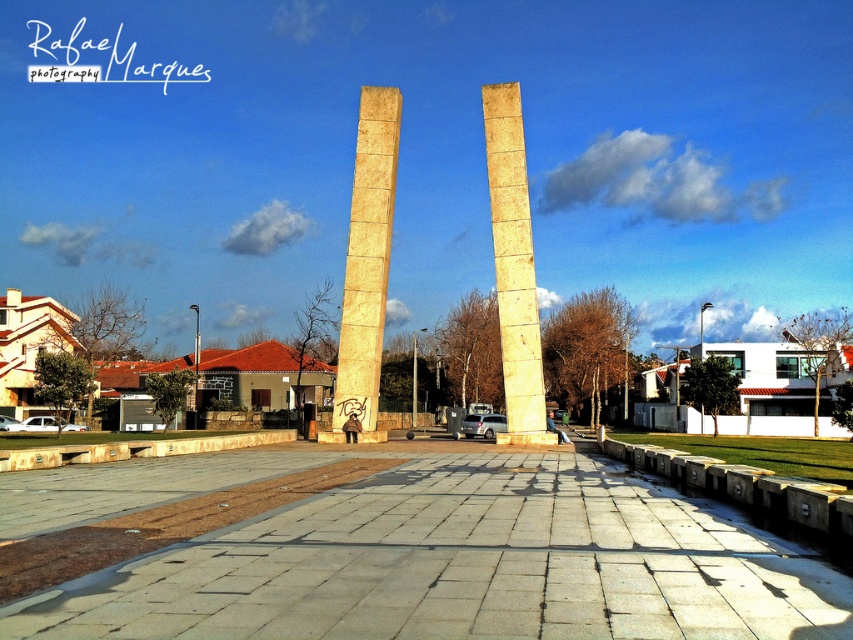
Is yellow stone column at center positioned behind yellow marble pillar at center?

Yes.

The height and width of the screenshot is (640, 853). Describe the element at coordinates (366, 262) in the screenshot. I see `yellow stone column at center` at that location.

In order to click on yellow stone column at center in this screenshot , I will do `click(366, 262)`.